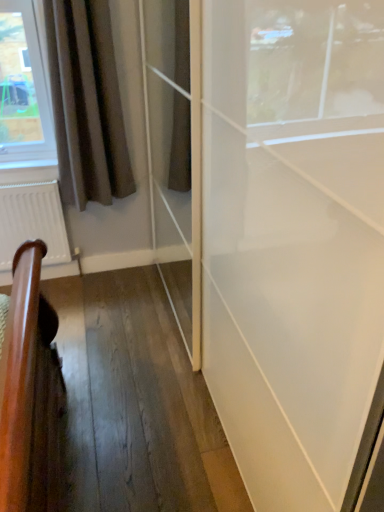
Locate an element on the screen. This screenshot has width=384, height=512. vacant space underneath brown fabric curtain at left (from a real-world perspective) is located at coordinates (103, 277).